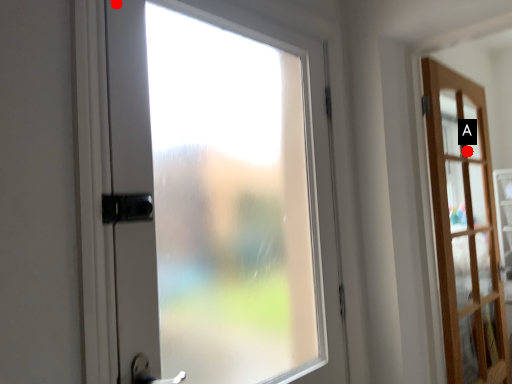
Question: Two points are circled on the image, labeled by A and B beside each circle. Which point appears farthest from the camera in this image?

Choices:
 (A) A is further
 (B) B is further

Answer: (A)